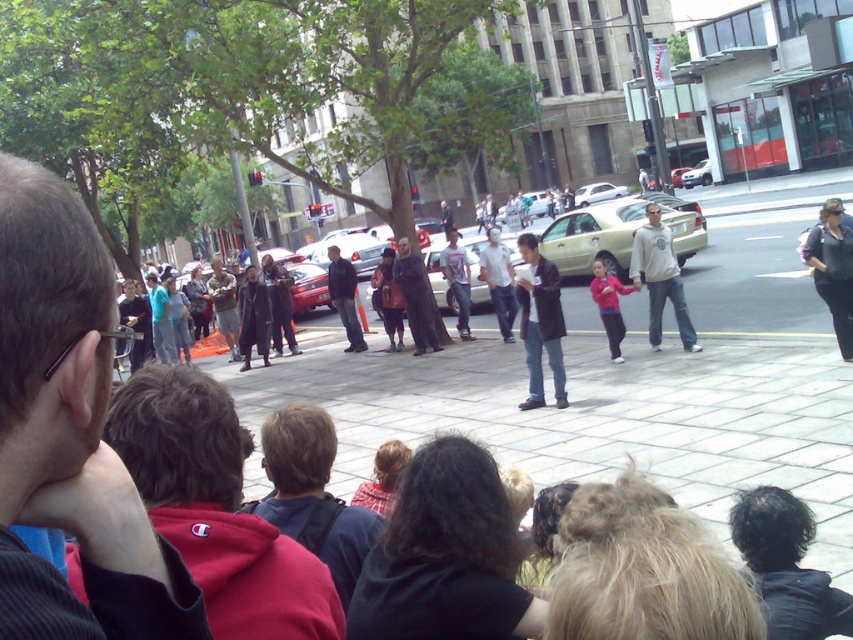
You are a photographer standing in the crowd and want to capture a photo of both the black matte cape at center and the metallic silver sedan at center. Based on their positions, which object should you frame first in your camera viewfinder to ensure both are in the shot?

The black matte cape at center is to the left of metallic silver sedan at center, so you should frame the metallic silver sedan at center first as it is on the right side, allowing the black matte cape at center to naturally come into the frame from the left.

You are a pedestrian standing at the edge of the crowd watching the event. You notice the light gray sweatshirt at center and the metallic silver sedan at center. Which object is closer to the camera?

The light gray sweatshirt at center is closer to the camera because it is located below the metallic silver sedan at center, meaning it is in a lower position in the image which typically corresponds to being closer to the viewer in such scenes.

You are a photographer positioned at the center of the scene. You want to capture a photo of the black leather jacket at right. Based on its coordinates, is it within your field of view if your camera has a standard 50mm lens?

The black leather jacket at right is located at point (833, 269), which falls within the standard 50mm lens field of view. Yes, it is within your field of view.